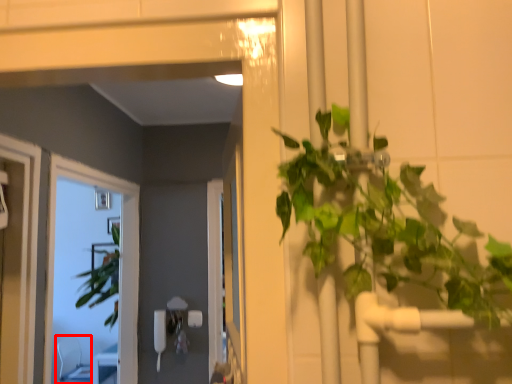
Question: From the image's perspective, where is chair (annotated by the red box) located in relation to window in the image?

Choices:
 (A) below
 (B) above

Answer: (A)